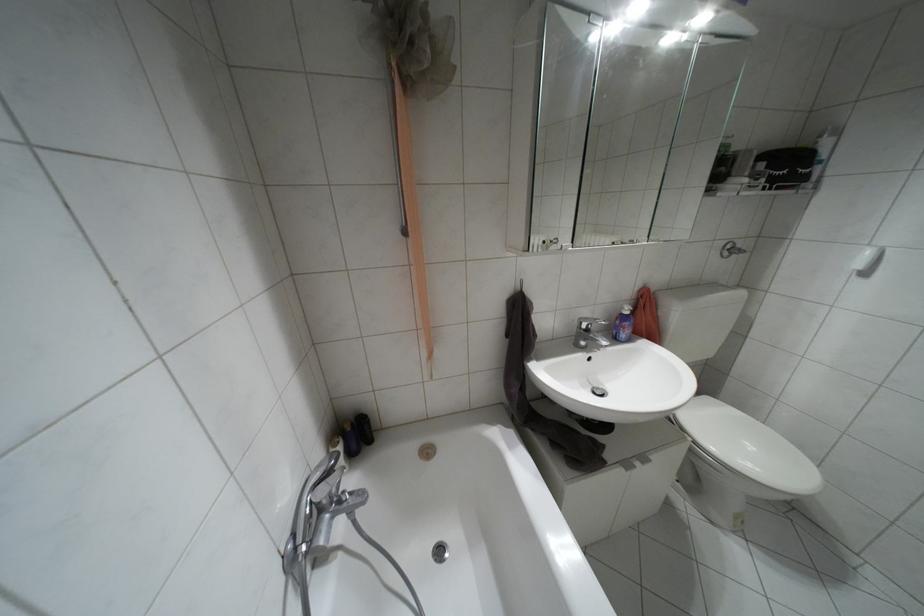
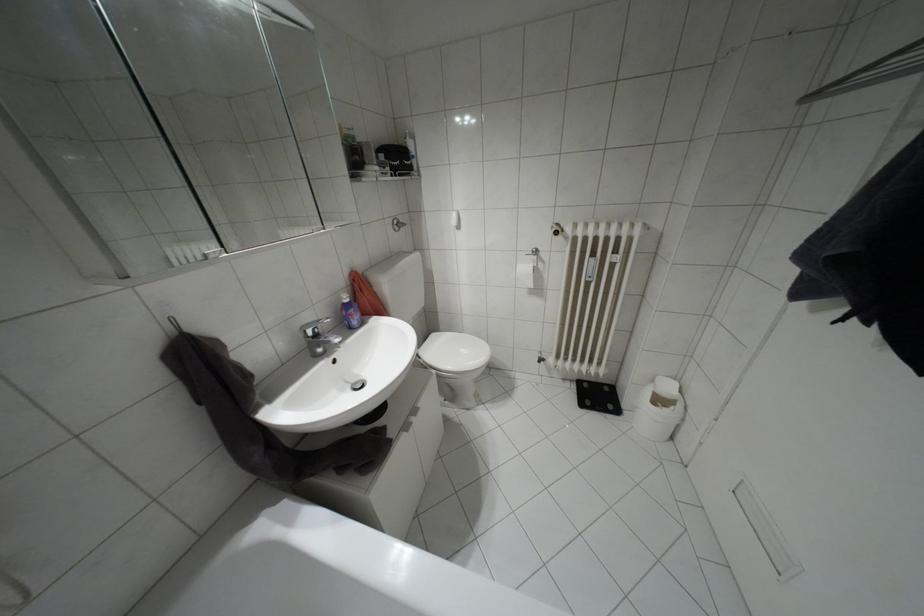
In the second image, find the point that corresponds to the point at 585,318 in the first image.

(307, 323)